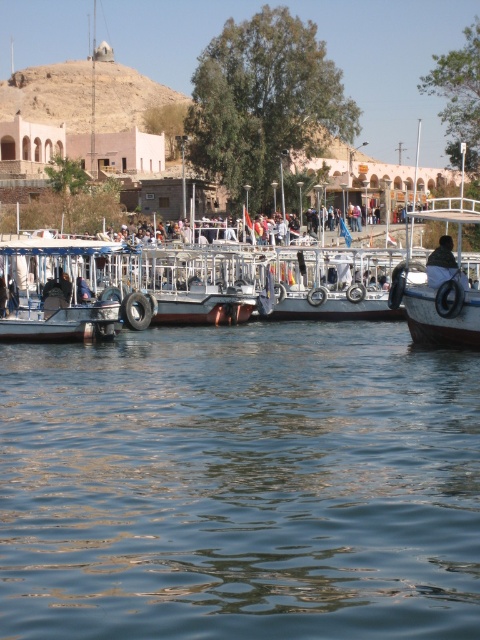
You are a tour guide leading a group of tourists on a boat trip. You need to ensure that your group can hear your commentary clearly. The sound of your voice can travel up to 20 meters in this environment. Can the tourists standing at the transparent water at center hear you if you are standing at the dark brown leather jacket at center?

The distance between transparent water at center and dark brown leather jacket at center is 18.43 meters. Since the sound can travel up to 20 meters, the tourists at transparent water at center can hear the commentary from the dark brown leather jacket at center.

You are a tour guide who needs to fit a group of 10 tourists onto a boat. The white wooden boat at left can accommodate 5 people, and the white matte boat at right can hold 10. Which boat should you choose?

You should choose the white matte boat at right because it can hold 10 people, which matches the group size of 10 tourists.

You are a tourist standing at the center of the waterfront scene. You want to take a photo of the white wooden boat at left. Where should you position yourself to capture the boat in your camera frame?

To capture the white wooden boat at left in your camera frame, you should position yourself at the center of the waterfront scene since the boat is located at coordinates point (60, 289), which places it within the visible area from that position.